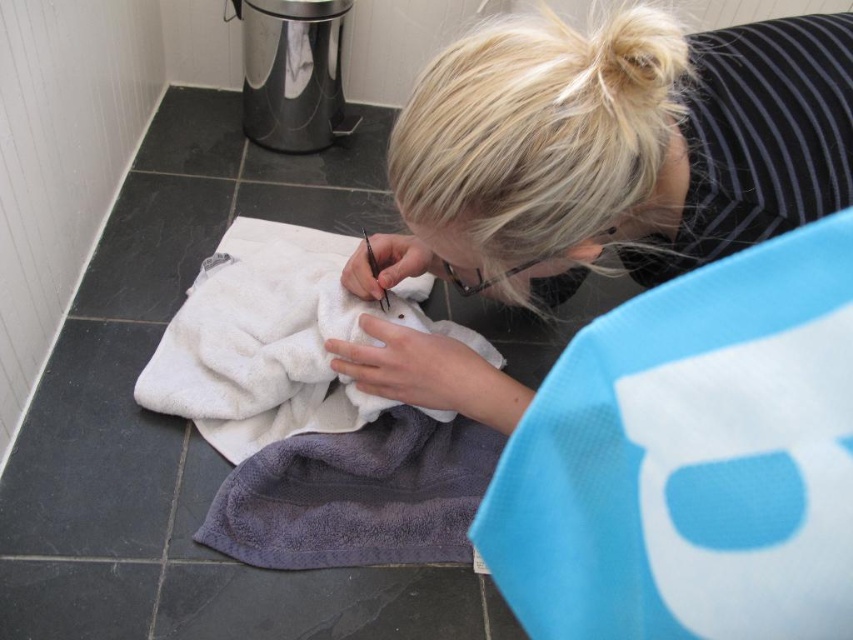
Question: Can you confirm if blonde hair at center is bigger than white soft towel at center?

Choices:
 (A) no
 (B) yes

Answer: (B)

Question: Which object is positioned farthest from the white soft towel at center?

Choices:
 (A) gray terry towel at lower center
 (B) blonde hair at center

Answer: (B)

Question: Considering the real-world distances, which object is closest to the gray terry towel at lower center?

Choices:
 (A) blonde hair at center
 (B) white soft towel at center

Answer: (B)

Question: Does blonde hair at center lie behind gray terry towel at lower center?

Choices:
 (A) no
 (B) yes

Answer: (A)

Question: Does blonde hair at center have a lesser width compared to white soft towel at center?

Choices:
 (A) no
 (B) yes

Answer: (A)

Question: Which point is farther to the camera?

Choices:
 (A) white soft towel at center
 (B) gray terry towel at lower center
 (C) blonde hair at center

Answer: (A)